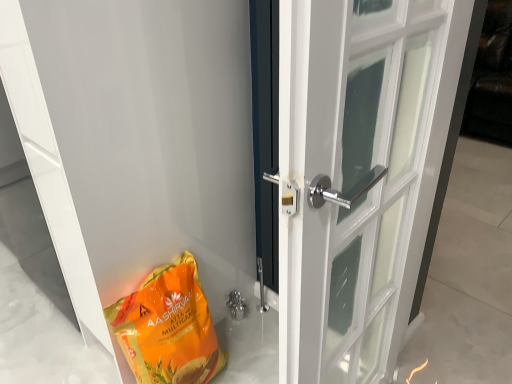
Question: From the image's perspective, would you say polished chrome door handle at center, which is the first door in right-to-left order, is shown under orange matte/glossy grocery bag at lower left?

Choices:
 (A) yes
 (B) no

Answer: (B)

Question: Can you confirm if polished chrome door handle at center, marked as the second door in a left-to-right arrangement, is bigger than orange matte/glossy grocery bag at lower left?

Choices:
 (A) yes
 (B) no

Answer: (A)

Question: Considering the relative positions of polished chrome door handle at center, marked as the second door in a left-to-right arrangement, and orange matte/glossy grocery bag at lower left in the image provided, is polished chrome door handle at center, marked as the second door in a left-to-right arrangement, to the right of orange matte/glossy grocery bag at lower left from the viewer's perspective?

Choices:
 (A) no
 (B) yes

Answer: (B)

Question: Is polished chrome door handle at center, which is the first door in right-to-left order, facing away from orange matte/glossy grocery bag at lower left?

Choices:
 (A) yes
 (B) no

Answer: (B)

Question: Is polished chrome door handle at center, which is the first door in right-to-left order, placed right next to orange matte/glossy grocery bag at lower left?

Choices:
 (A) yes
 (B) no

Answer: (B)

Question: Does polished chrome door handle at center, marked as the second door in a left-to-right arrangement, lie behind orange matte/glossy grocery bag at lower left?

Choices:
 (A) yes
 (B) no

Answer: (A)

Question: Is polished chrome door handle at center, marked as the second door in a left-to-right arrangement, to the left of white glossy door at lower left, positioned as the second door in right-to-left order, from the viewer's perspective?

Choices:
 (A) no
 (B) yes

Answer: (A)

Question: Does polished chrome door handle at center, marked as the second door in a left-to-right arrangement, have a smaller size compared to white glossy door at lower left, positioned as the first door in left-to-right order?

Choices:
 (A) yes
 (B) no

Answer: (A)

Question: From the image's perspective, is polished chrome door handle at center, marked as the second door in a left-to-right arrangement, beneath white glossy door at lower left, positioned as the second door in right-to-left order?

Choices:
 (A) yes
 (B) no

Answer: (A)

Question: Can you confirm if polished chrome door handle at center, marked as the second door in a left-to-right arrangement, is bigger than white glossy door at lower left, positioned as the first door in left-to-right order?

Choices:
 (A) no
 (B) yes

Answer: (A)

Question: From a real-world perspective, is polished chrome door handle at center, marked as the second door in a left-to-right arrangement, over white glossy door at lower left, positioned as the second door in right-to-left order?

Choices:
 (A) no
 (B) yes

Answer: (A)

Question: Does polished chrome door handle at center, marked as the second door in a left-to-right arrangement, touch white glossy door at lower left, positioned as the second door in right-to-left order?

Choices:
 (A) no
 (B) yes

Answer: (A)

Question: Is orange matte/glossy grocery bag at lower left to the right of polished chrome door handle at center, which is the first door in right-to-left order, from the viewer's perspective?

Choices:
 (A) yes
 (B) no

Answer: (B)